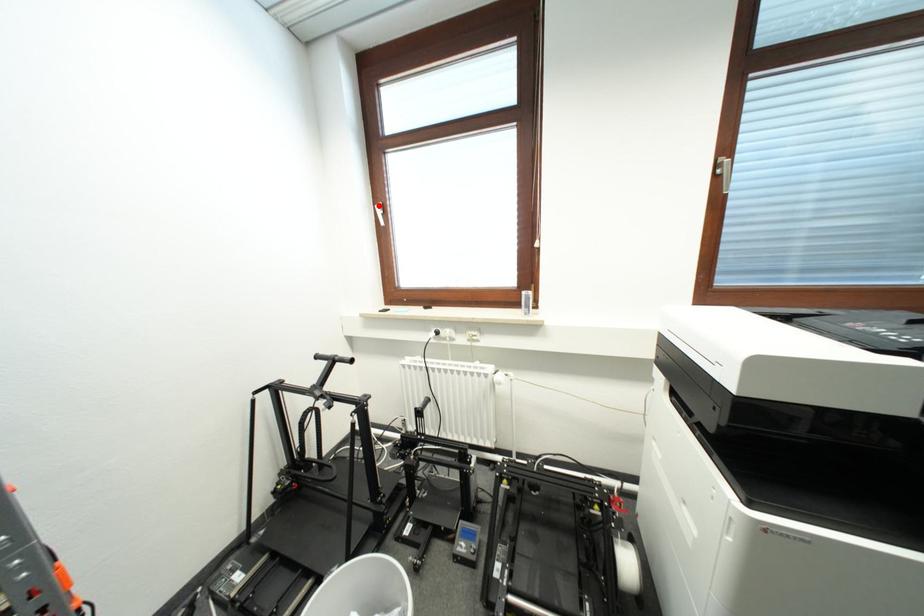
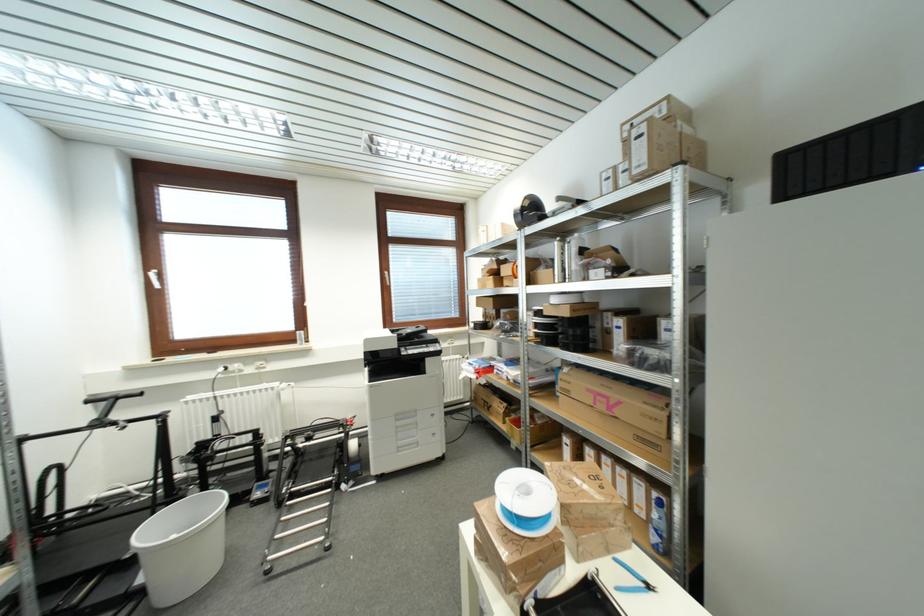
Question: I am providing you with two images of the same scene from different viewpoints. A red point is marked on the first image. Is the red point's position out of view in image 2?

Choices:
 (A) Yes
 (B) No

Answer: (B)